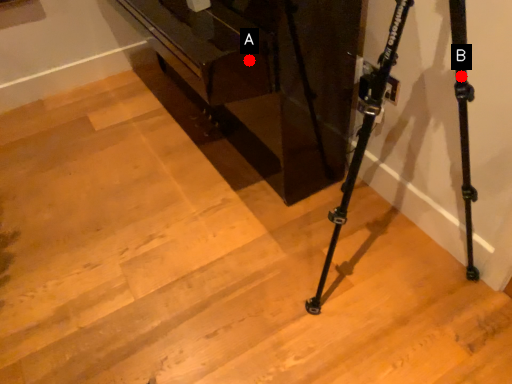
Question: Two points are circled on the image, labeled by A and B beside each circle. Which point is further to the camera?

Choices:
 (A) A is further
 (B) B is further

Answer: (A)